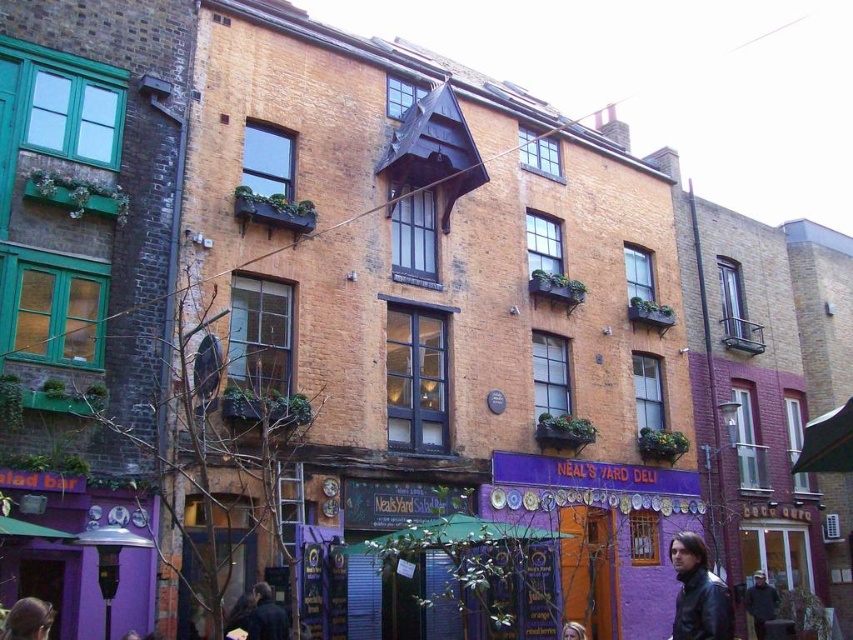
Question: Is black leather jacket at lower right to the right of dark brown hair at lower left from the viewer's perspective?

Choices:
 (A) yes
 (B) no

Answer: (A)

Question: Among these objects, which one is nearest to the camera?

Choices:
 (A) dark brown hair at lower left
 (B) blonde hair at center
 (C) dark gray jacket at lower right

Answer: (A)

Question: Can you confirm if black leather jacket at lower right is positioned above dark brown hair at lower left?

Choices:
 (A) no
 (B) yes

Answer: (A)

Question: Which object is farther from the camera taking this photo?

Choices:
 (A) blonde hair at center
 (B) dark blue jacket at lower left

Answer: (B)

Question: Does dark brown hair at lower left appear over blonde hair at center?

Choices:
 (A) yes
 (B) no

Answer: (A)

Question: Which of the following is the closest to the observer?

Choices:
 (A) (717, 627)
 (B) (26, 612)
 (C) (581, 636)

Answer: (B)